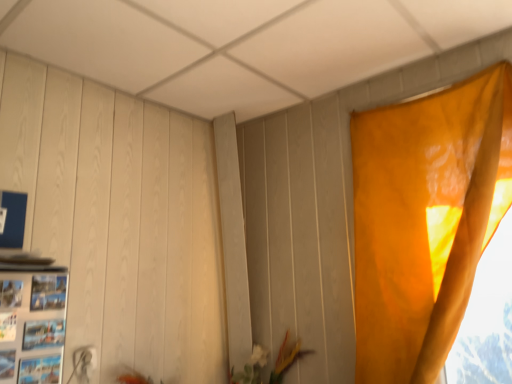
Describe the element at coordinates (425, 220) in the screenshot. This screenshot has height=384, width=512. I see `orange fabric curtain at right` at that location.

Where is `orange fabric curtain at right`? orange fabric curtain at right is located at coordinates (425, 220).

This screenshot has height=384, width=512. In order to click on orange fabric curtain at right in this screenshot , I will do `click(425, 220)`.